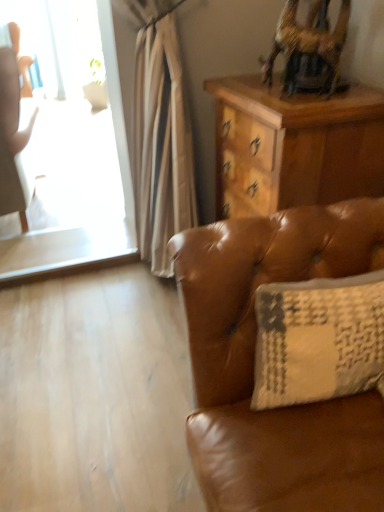
Question: Is beige textured pillow at right spatially inside wooden swivel chair at upper right, or outside of it?

Choices:
 (A) outside
 (B) inside

Answer: (A)

Question: Considering the relative positions of beige textured pillow at right and wooden swivel chair at upper right in the image provided, is beige textured pillow at right to the left or to the right of wooden swivel chair at upper right?

Choices:
 (A) right
 (B) left

Answer: (B)

Question: Considering the real-world distances, which object is closest to the wooden desk at upper right?

Choices:
 (A) wooden swivel chair at upper right
 (B) beige textured pillow at right
 (C) matte white chair at left

Answer: (A)

Question: Estimate the real-world distances between objects in this image. Which object is closer to the wooden swivel chair at upper right?

Choices:
 (A) matte white chair at left
 (B) wooden desk at upper right
 (C) beige textured pillow at right

Answer: (B)